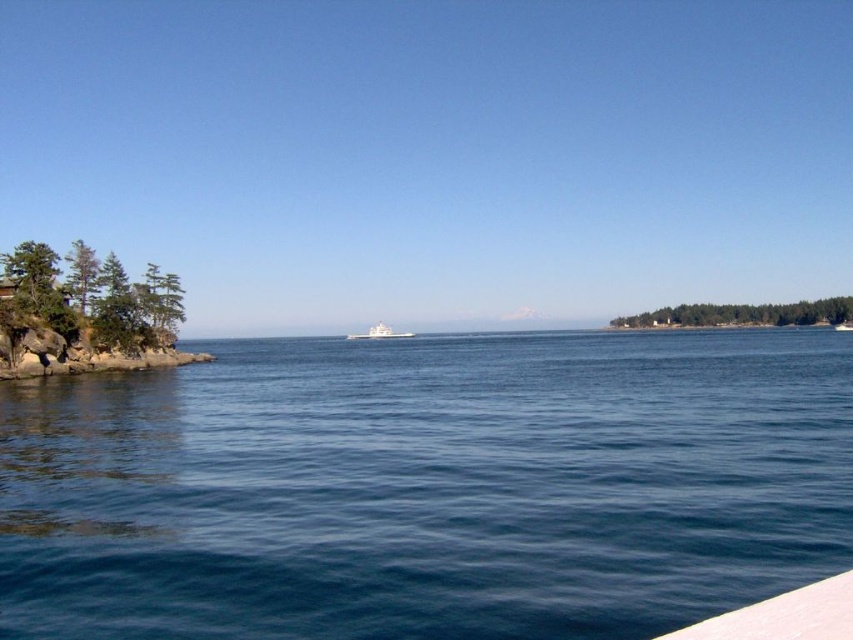
Which is more to the right, green textured rocks at left or white glossy boat at center?

From the viewer's perspective, white glossy boat at center appears more on the right side.

Is green textured rocks at left to the left of white glossy boat at center from the viewer's perspective?

Yes, green textured rocks at left is to the left of white glossy boat at center.

Between point (160, 275) and point (396, 333), which one is positioned in front?

Point (160, 275)

Identify the location of green textured rocks at left. (84, 314).

Between blue water at center and white glossy boat at center, which one is positioned lower?

white glossy boat at center is below.

Does point (724, 572) come farther from viewer compared to point (370, 328)?

No, (724, 572) is in front of (370, 328).

I want to click on blue water at center, so click(427, 486).

Between point (154, 600) and point (77, 371), which one is positioned in front?

Positioned in front is point (154, 600).

Between point (126, 540) and point (138, 326), which one is positioned behind?

The point (138, 326) is more distant.

Is point (712, 604) positioned in front of point (62, 291)?

Yes, point (712, 604) is closer to viewer.

Image resolution: width=853 pixels, height=640 pixels. Identify the location of blue water at center. (427, 486).